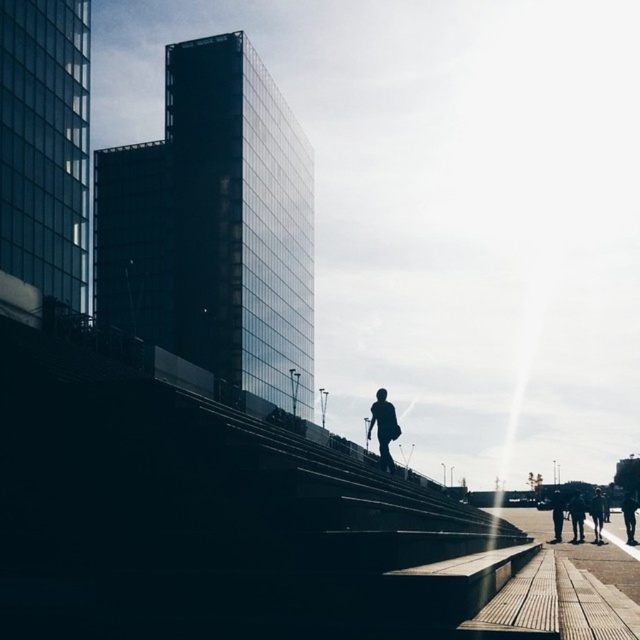
You are standing in the urban scene and want to move from the point at coordinates point (394,468) to the point at coordinates point (598,541). Which direction should you move relative to the buildings on the left side?

You should move away from the buildings on the left side because point (394,468) is closer to you than point (598,541), so moving away from the buildings would take you towards the farther point.

You are a security guard in the dark gray uniform at lower right. You see the silhouette figure at center moving towards the stairs. Based on their position, can you determine if they are approaching or moving away from you?

The silhouette figure at center is in front of the dark gray uniform at lower right, which means the figure is closer to you and moving towards the stairs. Since you are at the lower right, the figure is approaching you as they move upward towards the stairs.